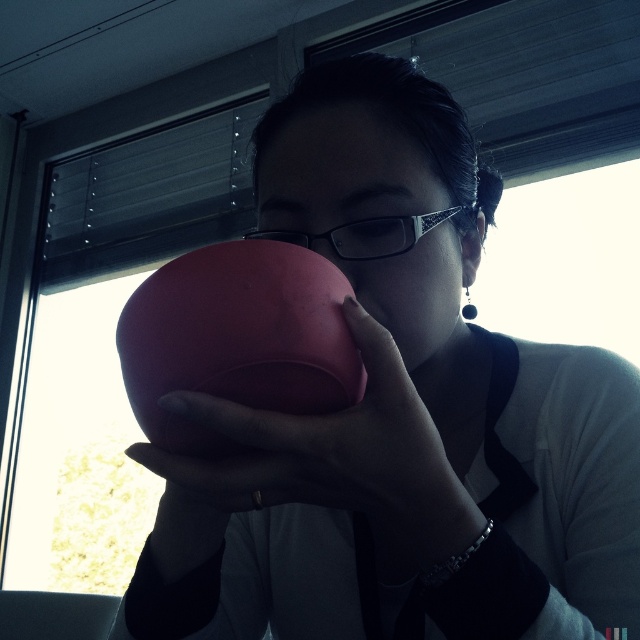
You are trying to locate the matte pink cup at center in the image. According to the coordinates provided, where exactly is it positioned?

The matte pink cup at center is located at point (321, 461).

Looking at this image, you are organizing items on a shelf and need to know the arrangement of the matte pink bowl at center and the matte pink piggy bank at center. According to the scene, which object is positioned higher?

The matte pink bowl at center is located above the matte pink piggy bank at center, so the bowl is higher.

You are a delivery robot with a 2 inch wide arm. You need to place a package between the matte pink cup at center and the matte pink piggy bank at center. Can your arm fit between them?

The distance between the matte pink cup at center and the matte pink piggy bank at center is 1.43 inches, which is narrower than the robot arm width of 2 inches. Therefore, the arm cannot fit between them.